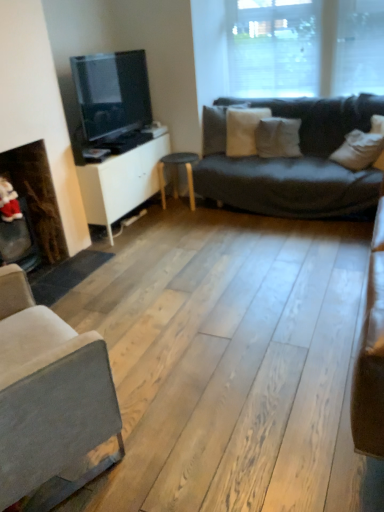
Question: Should I look upward or downward to see white soft pillow at center, the 2th pillow from the right?

Choices:
 (A) up
 (B) down

Answer: (A)

Question: Considering the relative sizes of matte black stool at center and transparent glass window at upper center in the image provided, is matte black stool at center thinner than transparent glass window at upper center?

Choices:
 (A) yes
 (B) no

Answer: (B)

Question: Does matte black stool at center have a larger size compared to transparent glass window at upper center?

Choices:
 (A) no
 (B) yes

Answer: (A)

Question: From the image's perspective, is matte black stool at center above transparent glass window at upper center?

Choices:
 (A) yes
 (B) no

Answer: (B)

Question: From the image's perspective, does matte black stool at center appear lower than transparent glass window at upper center?

Choices:
 (A) yes
 (B) no

Answer: (A)

Question: Can transparent glass window at upper center be found inside matte black stool at center?

Choices:
 (A) no
 (B) yes

Answer: (A)

Question: Considering the relative positions of matte black stool at center and transparent glass window at upper center in the image provided, is matte black stool at center to the left of transparent glass window at upper center from the viewer's perspective?

Choices:
 (A) no
 (B) yes

Answer: (B)

Question: Is the depth of transparent glass window at upper center less than that of dark brown wood fireplace at left?

Choices:
 (A) yes
 (B) no

Answer: (B)

Question: Is transparent glass window at upper center oriented towards dark brown wood fireplace at left?

Choices:
 (A) no
 (B) yes

Answer: (B)

Question: Is transparent glass window at upper center outside dark brown wood fireplace at left?

Choices:
 (A) no
 (B) yes

Answer: (B)

Question: From the image's perspective, is transparent glass window at upper center located beneath dark brown wood fireplace at left?

Choices:
 (A) yes
 (B) no

Answer: (B)

Question: Considering the relative sizes of transparent glass window at upper center and dark brown wood fireplace at left in the image provided, is transparent glass window at upper center smaller than dark brown wood fireplace at left?

Choices:
 (A) no
 (B) yes

Answer: (A)

Question: Is transparent glass window at upper center directly adjacent to dark brown wood fireplace at left?

Choices:
 (A) yes
 (B) no

Answer: (B)

Question: Does matte black stool at center have a lesser width compared to white matte cabinet at center?

Choices:
 (A) no
 (B) yes

Answer: (B)